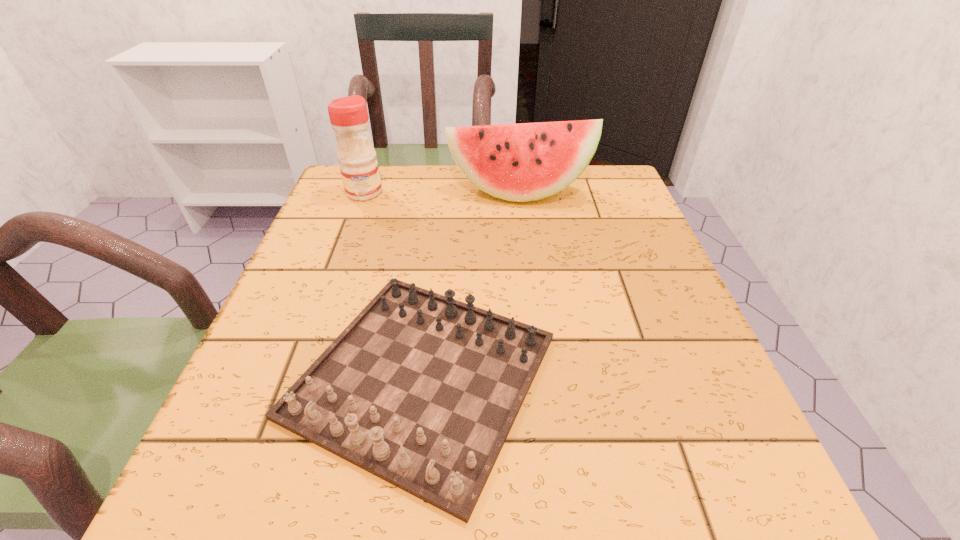
In the image, there is a desktop. Identify the location of free space at the far left corner. The height and width of the screenshot is (540, 960). (392, 189).

You are a GUI agent. You are given a task and a screenshot of the screen. Output one action in this format:
    pyautogui.click(x=<x>, y=<y>)
    Task: Click on the vacant position at the near left corner of the desktop
    
    Given the screenshot: What is the action you would take?
    pyautogui.click(x=298, y=485)

Locate an element on the screen. vacant space at the far right corner of the desktop is located at coordinates (595, 190).

Identify the location of vacant region between the watermelon and the chessboard. (469, 284).

The width and height of the screenshot is (960, 540). Identify the location of free area in between the tallest object and the second shortest object. (442, 192).

Where is `free space between the chessboard and the watermelon`? free space between the chessboard and the watermelon is located at coordinates (469, 284).

Locate an element on the screen. Image resolution: width=960 pixels, height=540 pixels. free spot between the second tallest object and the tallest object is located at coordinates (442, 192).

Where is `free spot between the shortest object and the second tallest object`? The height and width of the screenshot is (540, 960). free spot between the shortest object and the second tallest object is located at coordinates (469, 284).

Where is `vacant point located between the second shortest object and the condiment`? vacant point located between the second shortest object and the condiment is located at coordinates (442, 192).

Locate an element on the screen. The width and height of the screenshot is (960, 540). unoccupied area between the second tallest object and the tallest object is located at coordinates (442, 192).